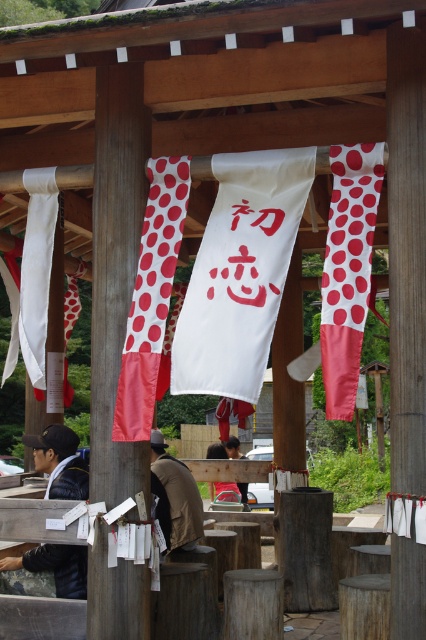
You are a visitor at the shrine and want to take a photo of both the white matte banner at left and the brown leather jacket at center. Since you have a limited field of view, will you need to adjust your camera angle to include both in the frame?

The white matte banner at left has a larger size compared to brown leather jacket at center, so you will need to adjust your camera angle to include both in the frame since the banner takes up more space.

You are a visitor at the shrine and want to take a photo of both the white fabric banner at center and the brown suede jacket at center. Since you can only focus on one object at a time, which object should you focus on to ensure the other is still in the frame?

The white fabric banner at center is positioned on the left side of brown suede jacket at center, so focusing on the brown suede jacket at center would keep the white fabric banner at center in the frame as it is to the left.

You are a visitor at the shrine and want to take a photo of the white matte banner at left and the brown leather jacket at center. Which object is taller so that it can be framed properly in the shot?

The white matte banner at left is taller than the brown leather jacket at center, so it should be framed properly in the shot.